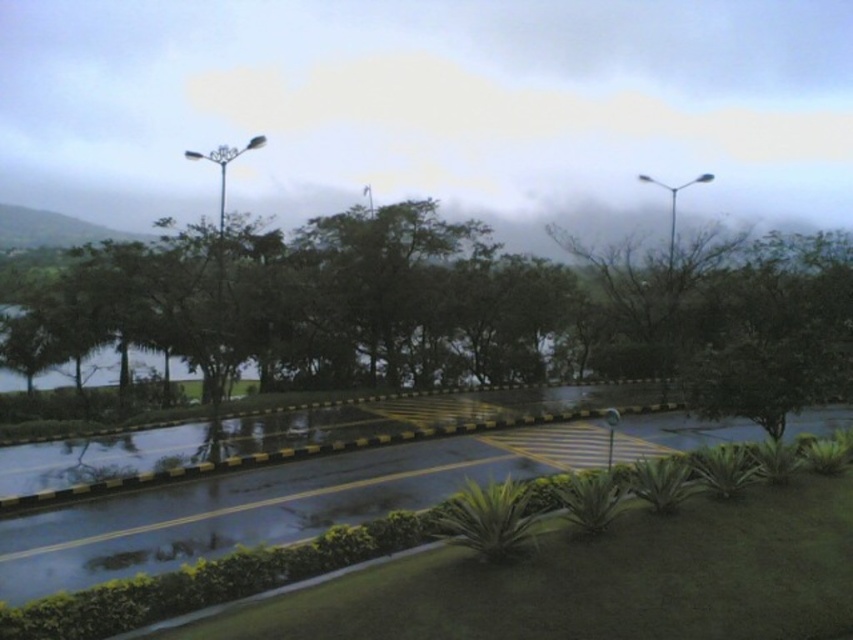
Question: Can you confirm if green leafy tree at center is positioned below wet asphalt road at lower center?

Choices:
 (A) no
 (B) yes

Answer: (A)

Question: Which of the following is the farthest from the observer?

Choices:
 (A) wet asphalt road at lower center
 (B) green leafy tree at center

Answer: (B)

Question: Is green leafy tree at center positioned behind wet asphalt road at lower center?

Choices:
 (A) yes
 (B) no

Answer: (A)

Question: Among these objects, which one is nearest to the camera?

Choices:
 (A) green leafy tree at center
 (B) wet asphalt road at lower center

Answer: (B)

Question: Can you confirm if green leafy tree at center is positioned above wet asphalt road at lower center?

Choices:
 (A) no
 (B) yes

Answer: (B)